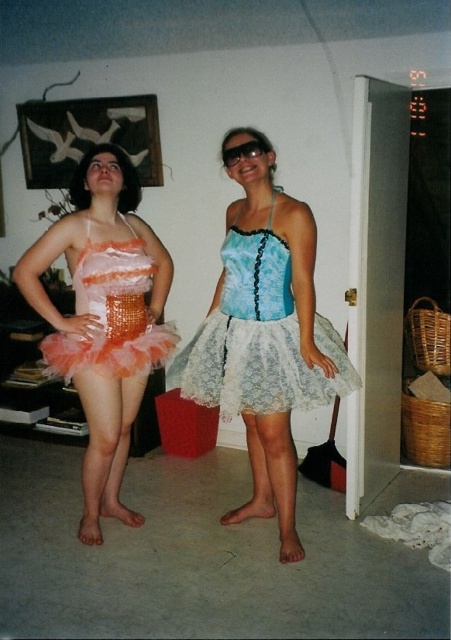
Question: Where is lace fabric tutu skirt at center located in relation to black plastic goggles at upper center in the image?

Choices:
 (A) left
 (B) right

Answer: (B)

Question: Can you confirm if lace fabric tutu skirt at center is positioned to the right of black plastic goggles at upper center?

Choices:
 (A) no
 (B) yes

Answer: (B)

Question: Is white lace ballet skirt at center below black plastic goggles at upper center?

Choices:
 (A) yes
 (B) no

Answer: (A)

Question: Which object is the closest to the lace fabric tutu skirt at center?

Choices:
 (A) white lace ballet skirt at center
 (B) black plastic goggles at upper center

Answer: (A)

Question: Which point is farther to the camera?

Choices:
 (A) (235, 154)
 (B) (74, 275)
 (C) (258, 204)

Answer: (B)

Question: Which point is closer to the camera taking this photo?

Choices:
 (A) (239, 406)
 (B) (248, 144)

Answer: (B)